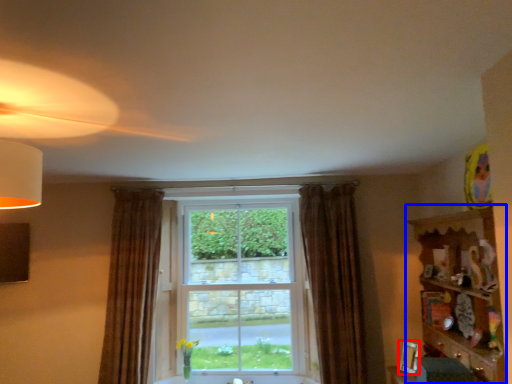
Question: Among these objects, which one is farthest to the camera, picture frame (highlighted by a red box) or dresser (highlighted by a blue box)?

Choices:
 (A) picture frame
 (B) dresser

Answer: (A)